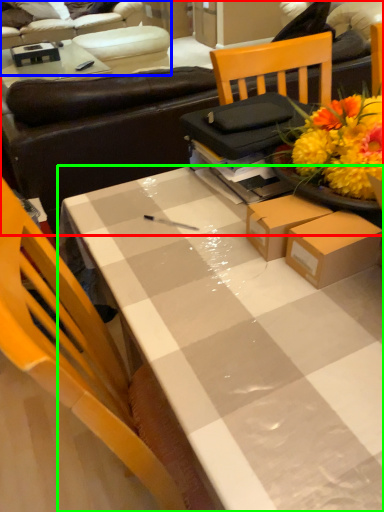
Question: Which object is the farthest from studio couch (highlighted by a red box)? Choose among these: studio couch (highlighted by a blue box) or desk (highlighted by a green box).

Choices:
 (A) studio couch
 (B) desk

Answer: (A)